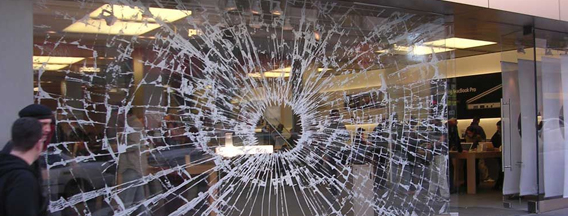
Find the location of `shattered window`. shattered window is located at coordinates (273, 135).